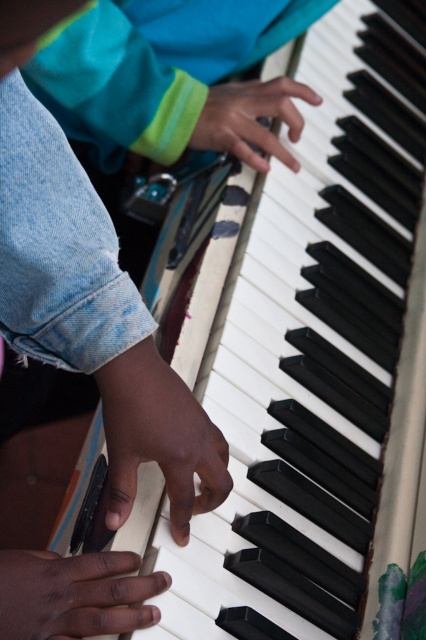
Question: Can you confirm if smooth skin hand at center is positioned below matte black hand at center?

Choices:
 (A) no
 (B) yes

Answer: (B)

Question: Does smooth skin hand at center appear on the right side of dark skin hand at lower left?

Choices:
 (A) yes
 (B) no

Answer: (A)

Question: Which point appears farthest from the camera in this image?

Choices:
 (A) (74, 589)
 (B) (126, 508)

Answer: (B)

Question: Which object is positioned closest to the matte black hand at center?

Choices:
 (A) smooth skin hand at center
 (B) dark skin hand at lower left

Answer: (A)

Question: Is smooth skin hand at center positioned before dark skin hand at lower left?

Choices:
 (A) yes
 (B) no

Answer: (B)

Question: Which point appears farthest from the camera in this image?

Choices:
 (A) (11, 564)
 (B) (175, 406)
 (C) (236, 108)

Answer: (C)